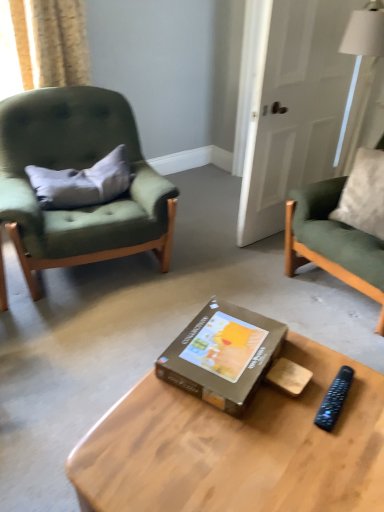
The image size is (384, 512). Find the location of `free spot in front of brown cardboard box at center`. free spot in front of brown cardboard box at center is located at coordinates (238, 444).